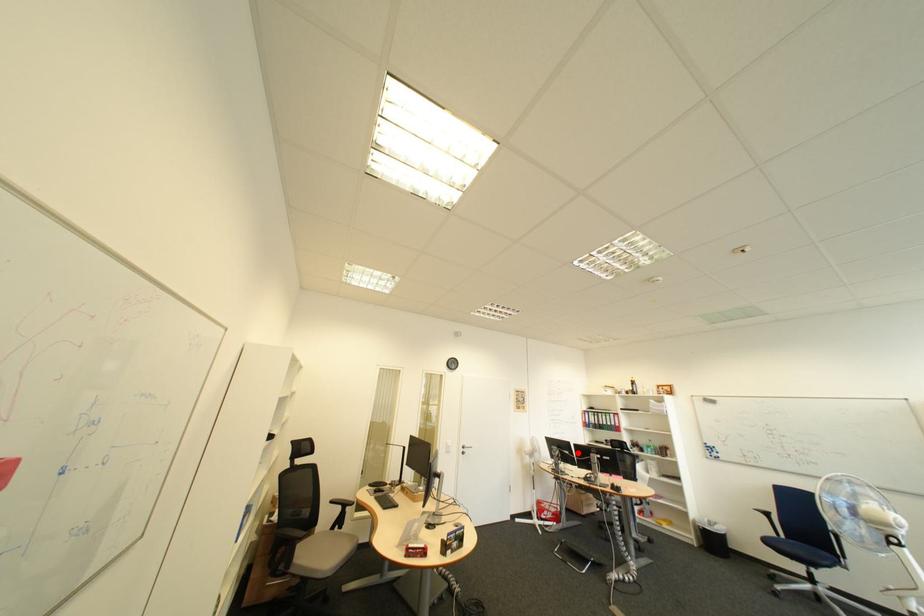
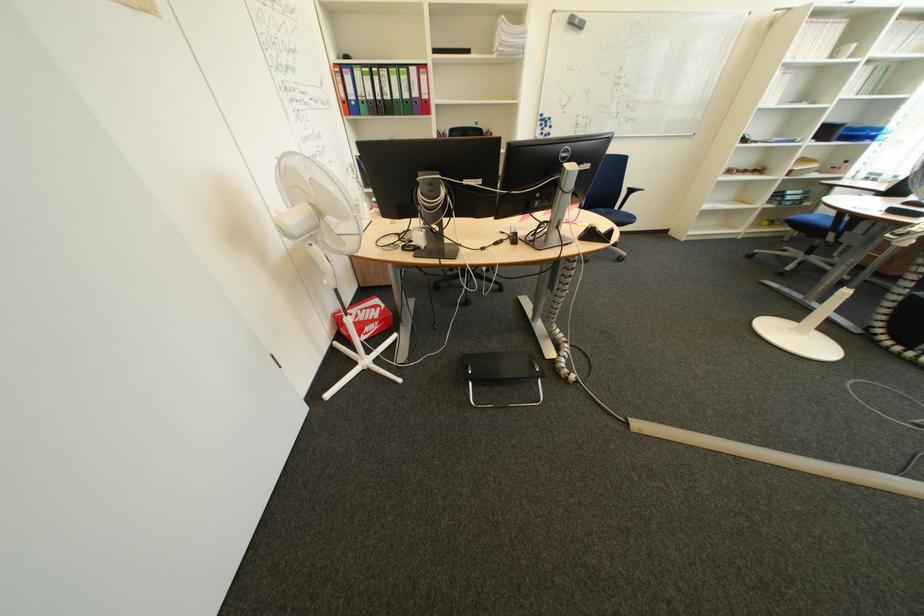
Locate, in the second image, the point that corresponds to the highlighted location in the first image.

(479, 184)